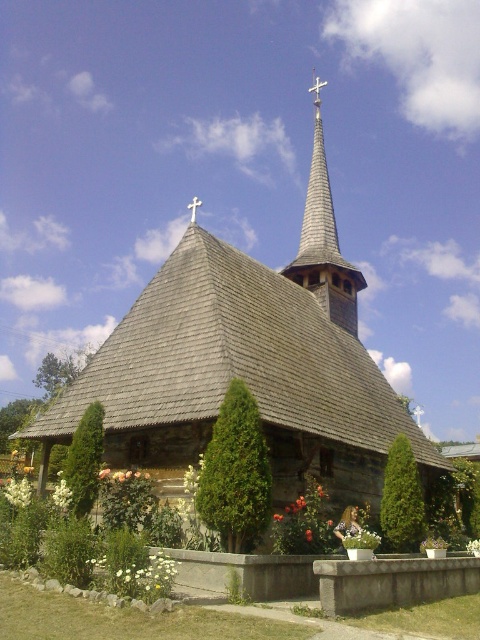
Can you confirm if green leafy bush at lower left is positioned to the right of white wooden cross at upper center?

No, green leafy bush at lower left is not to the right of white wooden cross at upper center.

Between green leafy bush at lower left and white wooden cross at upper center, which one is positioned higher?

Positioned higher is white wooden cross at upper center.

This screenshot has height=640, width=480. I want to click on green leafy bush at lower left, so click(84, 460).

Can you confirm if green textured bush at center is taller than green leafy bush at lower left?

Yes, green textured bush at center is taller than green leafy bush at lower left.

Is green textured bush at center to the right of green leafy bush at lower left from the viewer's perspective?

Yes, green textured bush at center is to the right of green leafy bush at lower left.

At what (x,y) coordinates should I click in order to perform the action: click on green textured bush at center. Please return your answer as a coordinate pair (x, y). Image resolution: width=480 pixels, height=640 pixels. Looking at the image, I should click on (236, 474).

Can you confirm if wooden shingles at center is positioned above green leafy bush at center?

Yes, wooden shingles at center is above green leafy bush at center.

Locate an element on the screen. The height and width of the screenshot is (640, 480). wooden shingles at center is located at coordinates (233, 358).

Identify the location of wooden shingles at center. (233, 358).